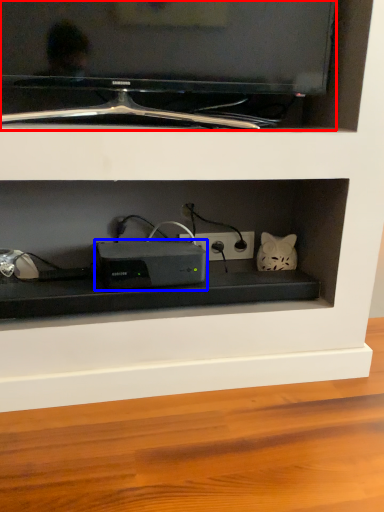
Question: Which point is closer to the camera, television (highlighted by a red box) or appliance (highlighted by a blue box)?

Choices:
 (A) television
 (B) appliance

Answer: (A)